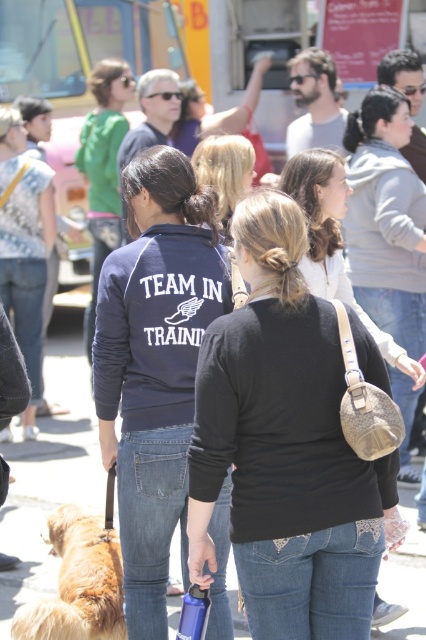
Image resolution: width=426 pixels, height=640 pixels. Describe the element at coordinates (284, 445) in the screenshot. I see `black matte sweater at center` at that location.

From the picture: Is black matte sweater at center closer to the viewer compared to golden fur dog at lower left?

Yes, it is in front of golden fur dog at lower left.

Is point (244, 420) farther from camera compared to point (74, 573)?

No, it is not.

Image resolution: width=426 pixels, height=640 pixels. I want to click on black matte sweater at center, so click(x=284, y=445).

Who is positioned more to the right, leather beige purse at center or golden fur dog at lower left?

leather beige purse at center is more to the right.

Between leather beige purse at center and golden fur dog at lower left, which one has less height?

With less height is golden fur dog at lower left.

Which is behind, point (417, 225) or point (94, 593)?

The point (417, 225) is behind.

At what (x,y) coordinates should I click in order to perform the action: click on leather beige purse at center. Please return your answer as a coordinate pair (x, y). Looking at the image, I should click on (385, 220).

Does leather beige purse at center appear on the left side of blonde hair at center?

No, leather beige purse at center is not to the left of blonde hair at center.

Is leather beige purse at center thinner than blonde hair at center?

Incorrect, leather beige purse at center's width is not less than blonde hair at center's.

Is point (383, 227) positioned after point (229, 244)?

Yes.

The image size is (426, 640). Identify the location of leather beige purse at center. (385, 220).